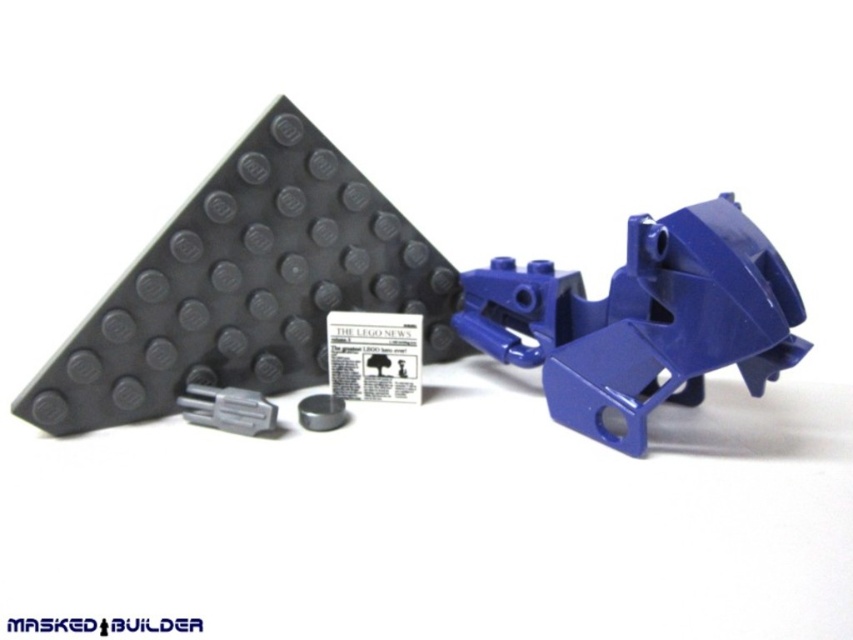
You are a LEGO enthusiast trying to build a display. You have a glossy plastic motorcycle at right and a gray matte plastic connector at lower left. Which object should you place on top of the other to ensure stability?

The glossy plastic motorcycle at right is taller than the gray matte plastic connector at lower left, so placing the taller motorcycle on top of the shorter connector would ensure stability as the connector can provide a stable base.